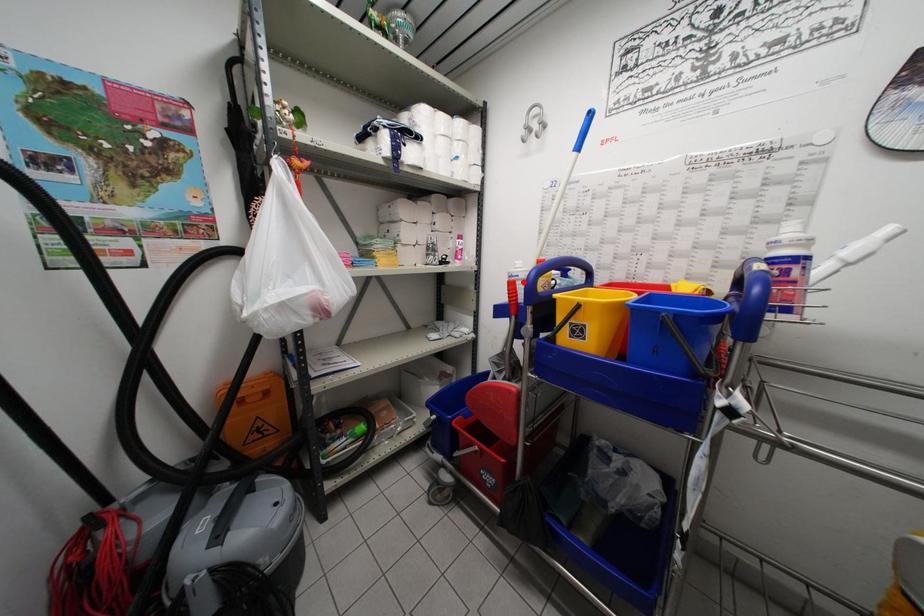
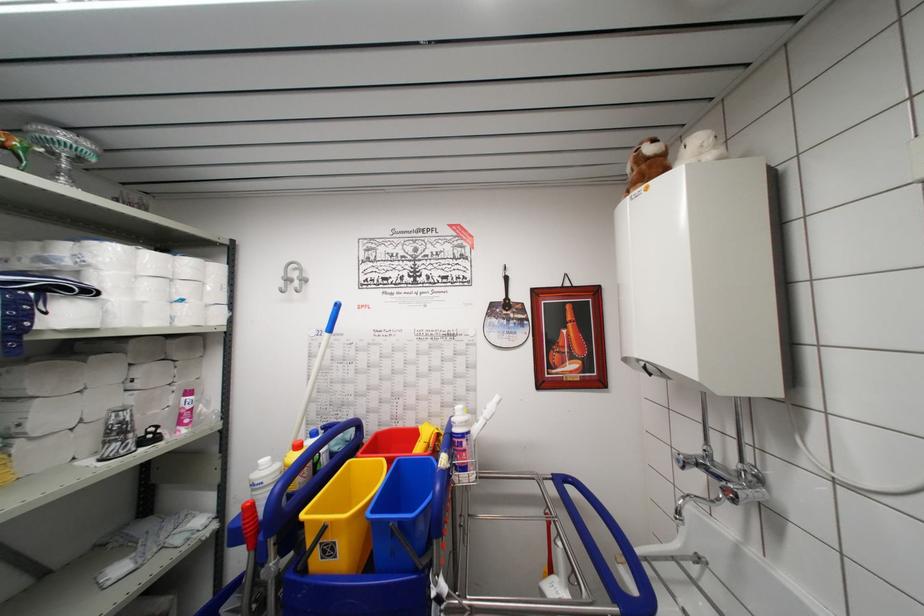
Find the pixel in the second image that matches the highlighted location in the first image.

(269, 488)